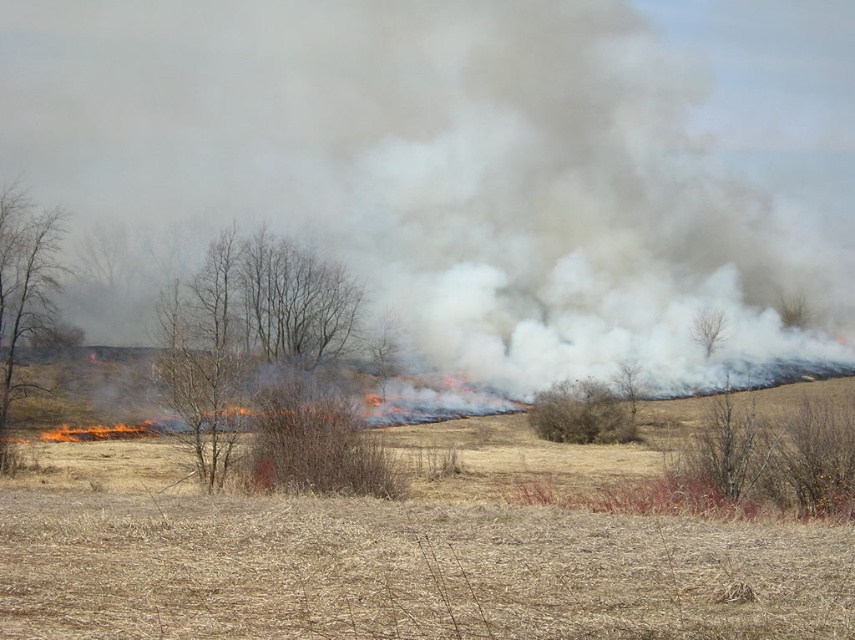
Is brown leafless tree at center bigger than brown dry bush at center?

Yes.

Which is behind, point (351, 284) or point (594, 412)?

The point (351, 284) is more distant.

This screenshot has height=640, width=855. Find the location of `brown leafless tree at center`. brown leafless tree at center is located at coordinates (266, 365).

Find the location of `brown leafless tree at center`. brown leafless tree at center is located at coordinates (266, 365).

Does point (600, 392) lie in front of point (705, 326)?

That is True.

Is brown dry bush at center thinner than bare branches at center?

No.

Identify the location of brown dry bush at center. (581, 413).

The height and width of the screenshot is (640, 855). Find the location of `brown dry bush at center`. brown dry bush at center is located at coordinates (581, 413).

Find the location of a particular element. The image size is (855, 640). bare branches at left is located at coordinates (24, 289).

Measure the distance between point (45,244) and camera.

Point (45,244) is 51.16 meters away from camera.

Is point (16, 212) positioned in front of point (635, 362)?

Yes, it is.

Identify the location of bare branches at left. The height and width of the screenshot is (640, 855). (24, 289).